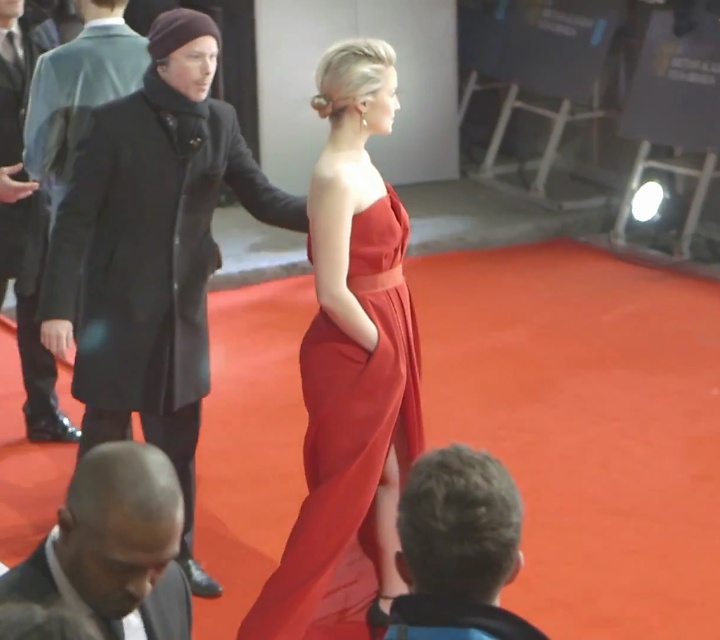
Question: From the image, what is the correct spatial relationship of shiny black suit at lower left in relation to black wool coat at left?

Choices:
 (A) below
 (B) above

Answer: (A)

Question: Is satin red dress at center above matte black coat at center?

Choices:
 (A) yes
 (B) no

Answer: (B)

Question: Does shiny black suit at lower left come in front of matte black coat at center?

Choices:
 (A) no
 (B) yes

Answer: (B)

Question: Estimate the real-world distances between objects in this image. Which object is farther from the satin red dress at center?

Choices:
 (A) smooth blue jacket at center
 (B) matte black coat at center
 (C) black wool coat at center

Answer: (B)

Question: Which object appears closest to the camera in this image?

Choices:
 (A) black wool coat at left
 (B) matte black coat at center
 (C) black wool coat at center
 (D) smooth blue jacket at center

Answer: (D)

Question: Which point is farther from the camera taking this photo?

Choices:
 (A) (168, 364)
 (B) (49, 196)
 (C) (397, 227)
 (D) (436, 481)

Answer: (B)